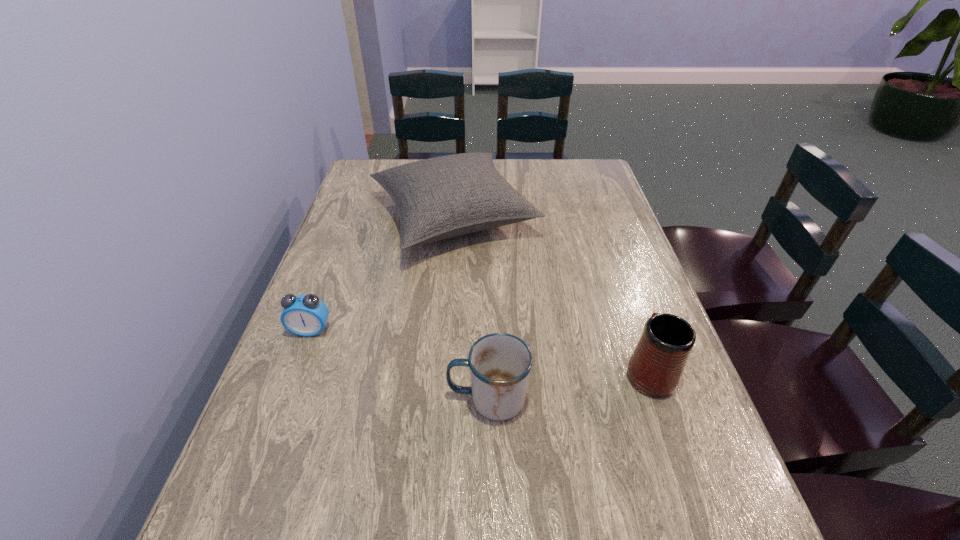
Locate an element on the screen. The image size is (960, 540). free space located 0.340m on the handle side of the left mug is located at coordinates (272, 399).

At what (x,y) coordinates should I click in order to perform the action: click on vacant space located on the handle side of the left mug. Please return your answer as a coordinate pair (x, y). The height and width of the screenshot is (540, 960). Looking at the image, I should click on (293, 399).

At what (x,y) coordinates should I click in order to perform the action: click on free space located 0.290m on the face of the second farthest object. Please return your answer as a coordinate pair (x, y). This screenshot has height=540, width=960. Looking at the image, I should click on (258, 469).

Identify the location of object that is at the far edge. (443, 197).

Identify the location of cushion that is at the left edge. coord(443,197).

The height and width of the screenshot is (540, 960). Identify the location of alarm clock that is positioned at the left edge. (305, 315).

The height and width of the screenshot is (540, 960). I want to click on object present at the right edge, so click(656, 366).

Identify the location of object positioned at the far left corner. This screenshot has height=540, width=960. (443, 197).

In the image, there is a desktop. Identify the location of blank space at the left edge. (297, 367).

Locate an element on the screen. Image resolution: width=960 pixels, height=540 pixels. free space at the right edge is located at coordinates (661, 462).